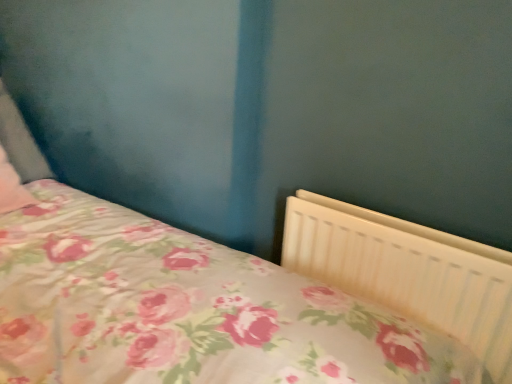
Question: From a real-world perspective, relative to pink floral fabric pillow at left, is white plastic radiator at lower right vertically above or below?

Choices:
 (A) above
 (B) below

Answer: (B)

Question: Looking at the image, does white plastic radiator at lower right seem bigger or smaller compared to pink floral fabric pillow at left?

Choices:
 (A) big
 (B) small

Answer: (A)

Question: Considering the relative positions of white plastic radiator at lower right and pink floral fabric pillow at left in the image provided, is white plastic radiator at lower right to the left or to the right of pink floral fabric pillow at left?

Choices:
 (A) left
 (B) right

Answer: (B)

Question: Visually, is pink floral fabric pillow at left positioned to the left or to the right of white plastic radiator at lower right?

Choices:
 (A) left
 (B) right

Answer: (A)

Question: Considering the positions of pink floral fabric pillow at left and white plastic radiator at lower right in the image, is pink floral fabric pillow at left wider or thinner than white plastic radiator at lower right?

Choices:
 (A) thin
 (B) wide

Answer: (B)

Question: From the image's perspective, is pink floral fabric pillow at left located above or below white plastic radiator at lower right?

Choices:
 (A) above
 (B) below

Answer: (A)

Question: Is point (17, 135) positioned closer to the camera than point (324, 246)?

Choices:
 (A) closer
 (B) farther

Answer: (B)